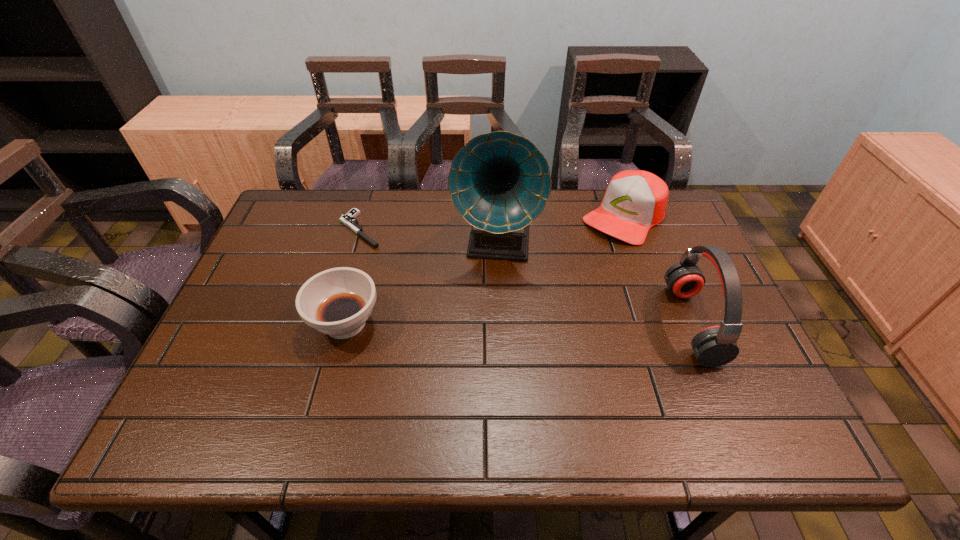
Find the location of a particular element. This screenshot has height=540, width=960. vacant space at the far right corner is located at coordinates (669, 204).

Where is `vacant space in between the soup bowl and the earphone`? This screenshot has height=540, width=960. vacant space in between the soup bowl and the earphone is located at coordinates (x=518, y=323).

Identify the location of free spot between the tallest object and the shortest object. The image size is (960, 540). (428, 237).

Where is `unoccupied area between the phonograph_record and the second tallest object`? The width and height of the screenshot is (960, 540). unoccupied area between the phonograph_record and the second tallest object is located at coordinates (593, 284).

You are a GUI agent. You are given a task and a screenshot of the screen. Output one action in this format:
    pyautogui.click(x=<x>, y=<y>)
    Task: Click on the blank region between the tallest object and the soup bowl
    The height and width of the screenshot is (540, 960).
    Given the screenshot: What is the action you would take?
    pyautogui.click(x=420, y=284)

Identify the location of free space between the baseball cap and the earphone. (659, 270).

Where is `free point between the second shortest object and the earphone`? free point between the second shortest object and the earphone is located at coordinates (518, 323).

Locate an element on the screen. Image resolution: width=960 pixels, height=540 pixels. free space between the baseball cap and the phonograph_record is located at coordinates (560, 230).

You are a GUI agent. You are given a task and a screenshot of the screen. Output one action in this format:
    pyautogui.click(x=<x>, y=<y>)
    Task: Click on the vacant space in between the fourth shortest object and the shortest object
    The width and height of the screenshot is (960, 540).
    Given the screenshot: What is the action you would take?
    pyautogui.click(x=526, y=276)

Identify the location of free spot between the earphone and the second shortest object. This screenshot has width=960, height=540. (518, 323).